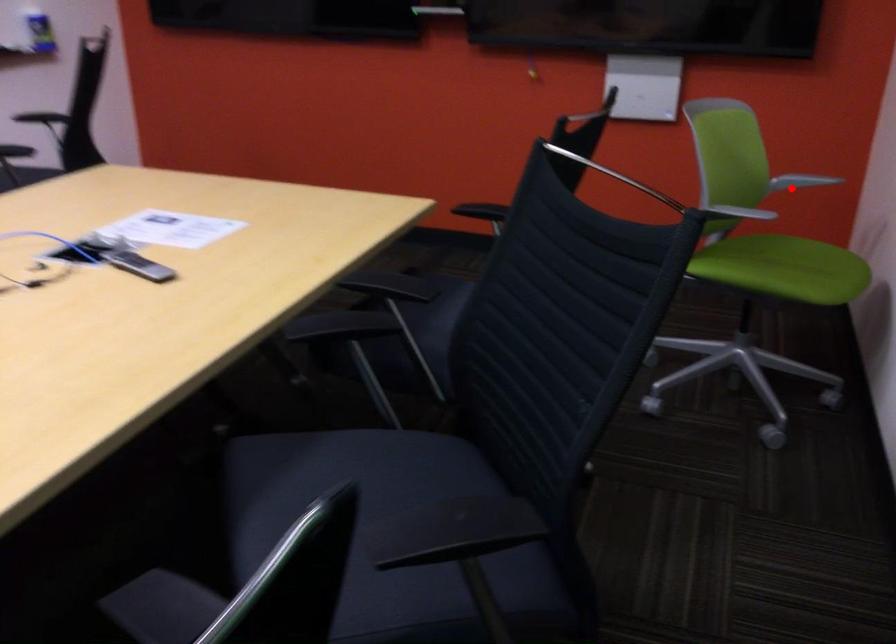
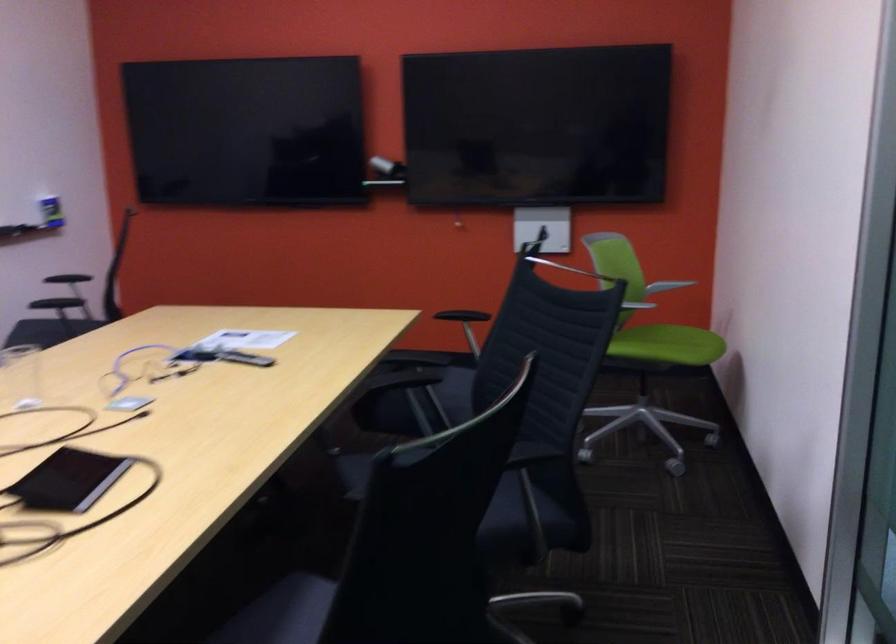
Question: I am providing you with two images of the same scene from different viewpoints. In image1, a red point is highlighted. Considering the same 3D point in image2, which of the following is correct?

Choices:
 (A) It is closer
 (B) It is farther

Answer: (B)